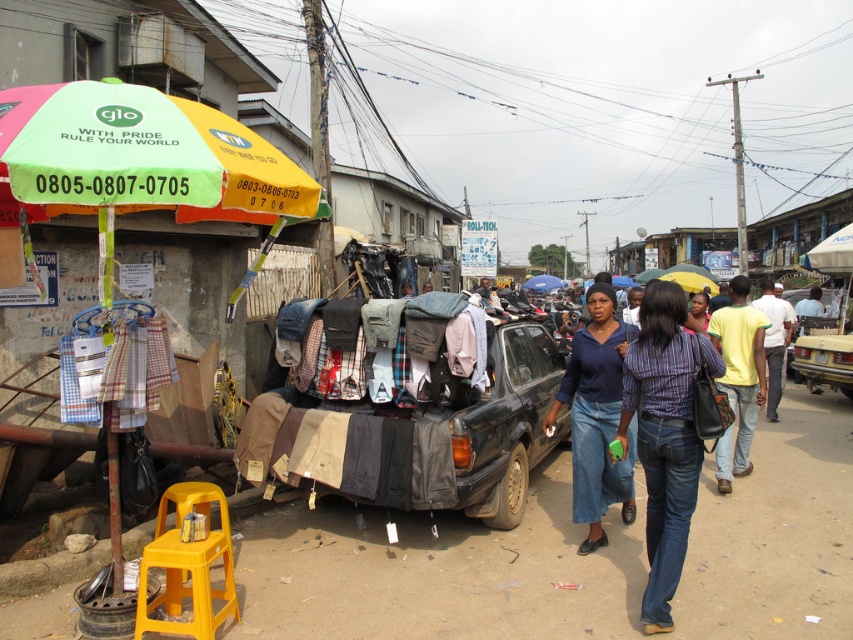
You are a delivery person standing at the point marked by the plastic umbrella at left located at point (x=141, y=161). You need to deliver a package to the car in the foreground. Which direction should you move to reach the car?

You should move to the right from the plastic umbrella at left located at point (x=141, y=161) to reach the car in the foreground since the car is to the right of the umbrella.

You are a delivery person trying to navigate through the bustling street scene. You need to deliver a package to the address located at point (422, 440). Which object in the scene is located at that coordinate?

The black matte car at center is located at point (422, 440).

You are a delivery person who needs to place a new striped cotton shirt at center onto the black matte car at center. Considering the size difference between them, will the shirt easily fit on the car without needing to remove any existing items?

The black matte car at center is larger in size compared to the striped cotton shirt at center, so the shirt will easily fit on the car without needing to remove any existing items.